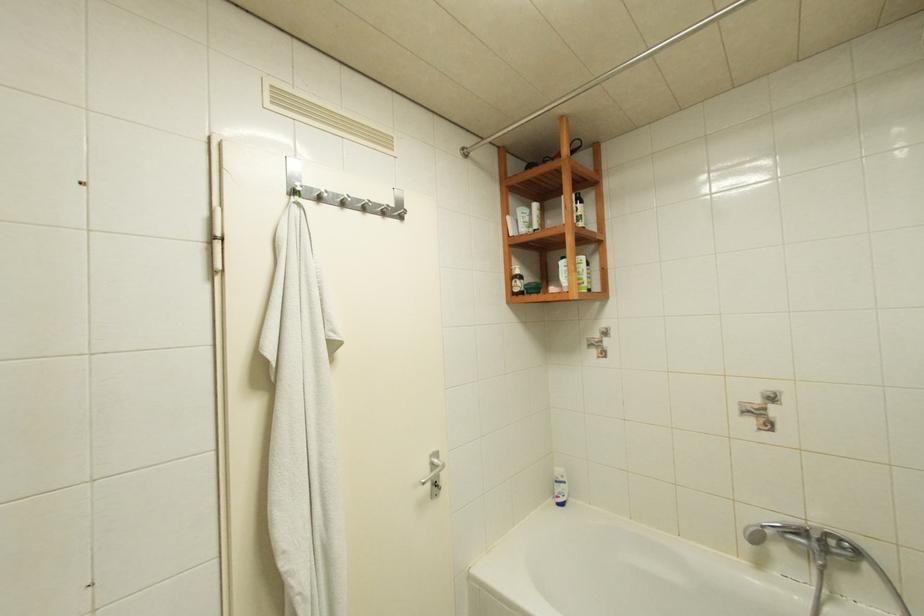
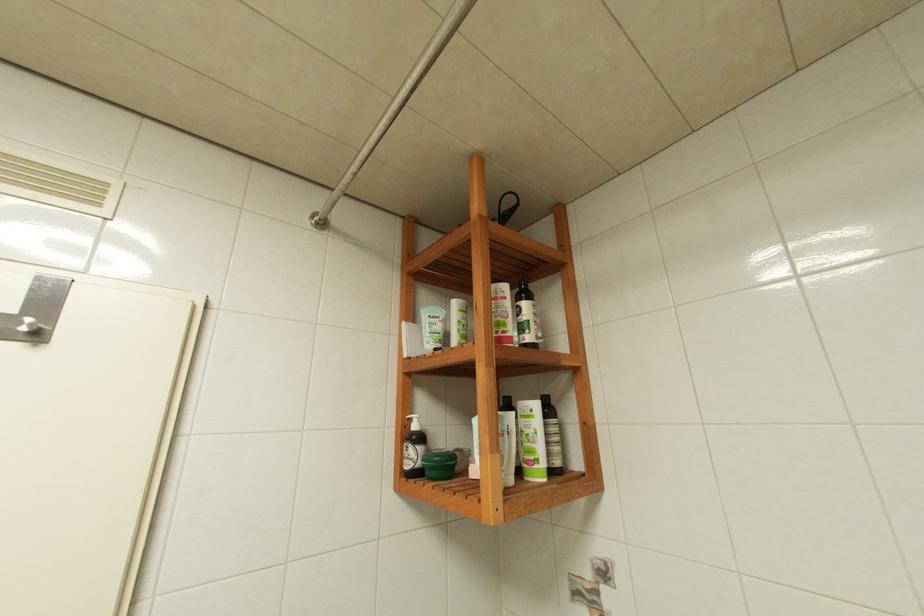
The images are taken continuously from a first-person perspective. In which direction are you moving?

The cameraman moved toward right, forward.